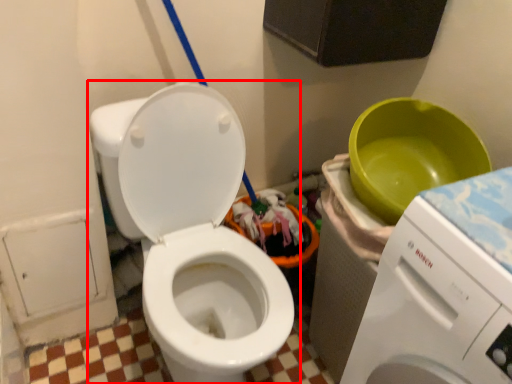
Question: Observing the image, what is the correct spatial positioning of toilet (annotated by the red box) in reference to washing machine?

Choices:
 (A) right
 (B) left

Answer: (B)